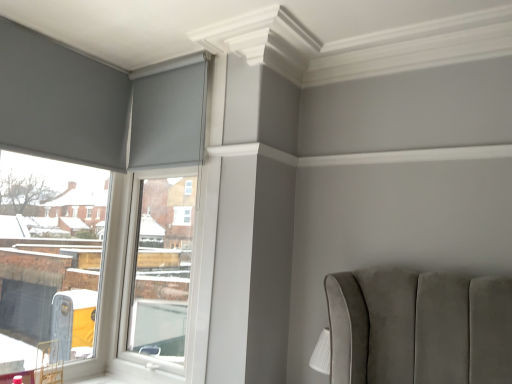
Question: Is matte gray curtain at upper left at the left side of matte gray roller blind at upper left?

Choices:
 (A) no
 (B) yes

Answer: (A)

Question: Is matte gray curtain at upper left to the right of matte gray roller blind at upper left from the viewer's perspective?

Choices:
 (A) no
 (B) yes

Answer: (B)

Question: Does matte gray curtain at upper left touch matte gray roller blind at upper left?

Choices:
 (A) yes
 (B) no

Answer: (B)

Question: Considering the relative sizes of matte gray curtain at upper left and matte gray roller blind at upper left in the image provided, is matte gray curtain at upper left smaller than matte gray roller blind at upper left?

Choices:
 (A) no
 (B) yes

Answer: (B)

Question: Can you confirm if matte gray curtain at upper left is taller than matte gray roller blind at upper left?

Choices:
 (A) no
 (B) yes

Answer: (A)

Question: Does point (198, 66) appear closer or farther from the camera than point (12, 334)?

Choices:
 (A) closer
 (B) farther

Answer: (B)

Question: Is white plastic window frame at upper left to the left or to the right of matte gray roller blind at upper left in the image?

Choices:
 (A) left
 (B) right

Answer: (B)

Question: From a real-world perspective, is white plastic window frame at upper left above or below matte gray roller blind at upper left?

Choices:
 (A) above
 (B) below

Answer: (B)

Question: In terms of height, does white plastic window frame at upper left look taller or shorter compared to matte gray roller blind at upper left?

Choices:
 (A) short
 (B) tall

Answer: (B)

Question: In terms of height, does matte gray curtain at upper left look taller or shorter compared to white plastic window frame at upper left?

Choices:
 (A) tall
 (B) short

Answer: (B)

Question: In terms of size, does matte gray curtain at upper left appear bigger or smaller than white plastic window frame at upper left?

Choices:
 (A) small
 (B) big

Answer: (A)

Question: In terms of width, does matte gray curtain at upper left look wider or thinner when compared to white plastic window frame at upper left?

Choices:
 (A) wide
 (B) thin

Answer: (B)

Question: Choose the correct answer: Is matte gray curtain at upper left inside white plastic window frame at upper left or outside it?

Choices:
 (A) outside
 (B) inside

Answer: (B)

Question: Relative to matte gray roller blind at upper left, is matte gray curtain at upper left in front or behind?

Choices:
 (A) behind
 (B) front

Answer: (A)

Question: Is point (151, 137) positioned closer to the camera than point (10, 188)?

Choices:
 (A) farther
 (B) closer

Answer: (A)